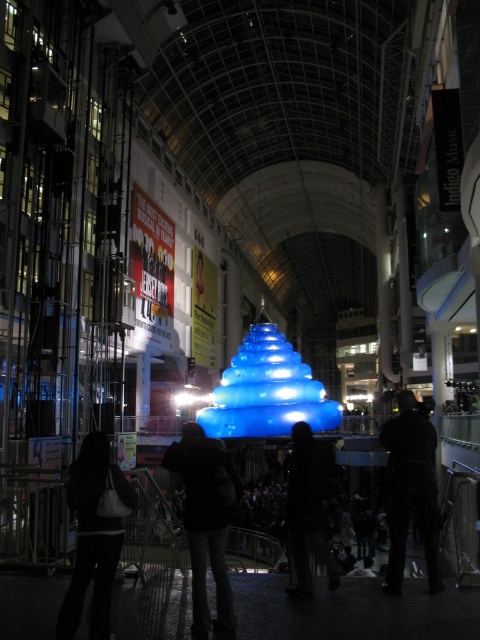
Can you confirm if black fabric jacket at center is shorter than silhouette coat at center?

No.

Is black fabric jacket at center bigger than silhouette coat at center?

Indeed, black fabric jacket at center has a larger size compared to silhouette coat at center.

What are the coordinates of `black fabric jacket at center` in the screenshot? It's located at (205, 520).

Where is `black fabric jacket at center`? Image resolution: width=480 pixels, height=640 pixels. black fabric jacket at center is located at coordinates (205, 520).

Which of these two, black fabric bag at lower left or black matte jacket at center, stands shorter?

Answer: black fabric bag at lower left is shorter.

Describe the element at coordinates (94, 538) in the screenshot. I see `black fabric bag at lower left` at that location.

The image size is (480, 640). I want to click on black fabric bag at lower left, so click(94, 538).

Does black fabric bag at lower left appear on the right side of silhouette coat at center?

In fact, black fabric bag at lower left is to the left of silhouette coat at center.

Does black fabric bag at lower left appear on the left side of silhouette coat at center?

Indeed, black fabric bag at lower left is positioned on the left side of silhouette coat at center.

You are a GUI agent. You are given a task and a screenshot of the screen. Output one action in this format:
    pyautogui.click(x=<x>, y=<y>)
    Task: Click on the black fabric bag at lower left
    The height and width of the screenshot is (640, 480).
    Given the screenshot: What is the action you would take?
    pyautogui.click(x=94, y=538)